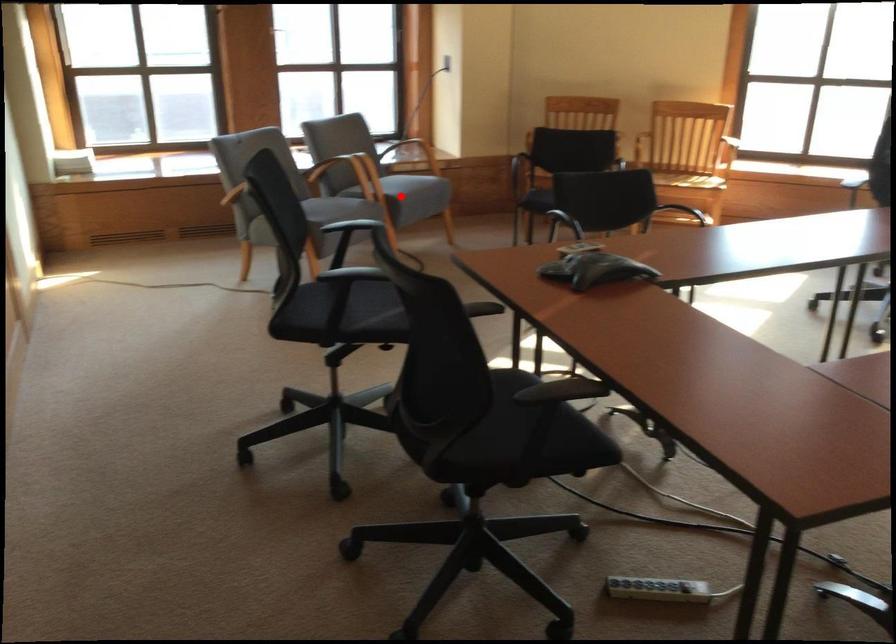
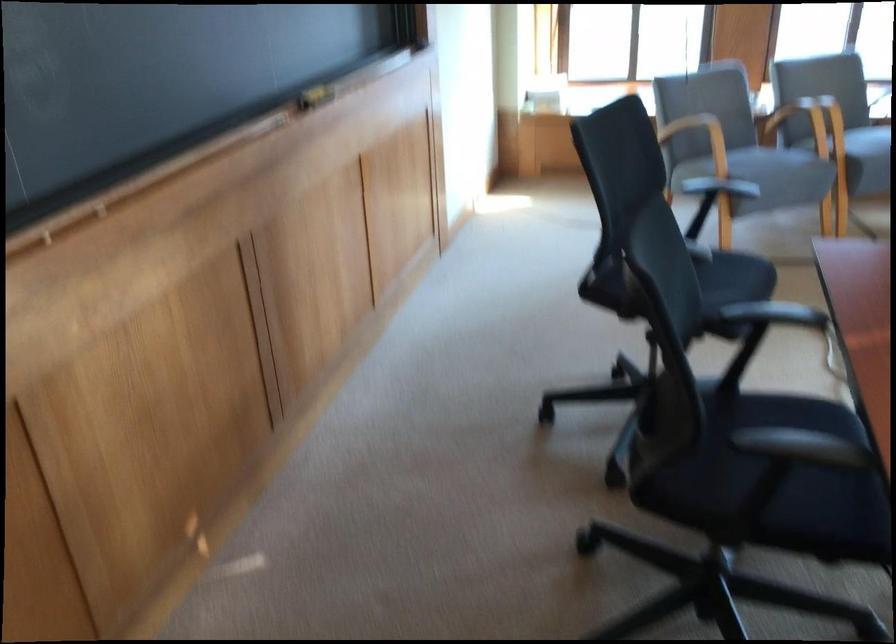
Question: I am providing you with two images of the same scene from different viewpoints. In image1, a red point is highlighted. Considering the same 3D point in image2, which of the following is correct?

Choices:
 (A) It is closer
 (B) It is farther

Answer: (A)